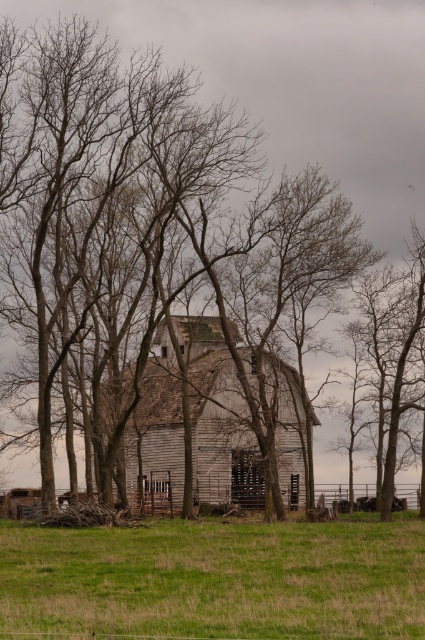
Does green grassy field at lower center appear over weathered wood barn at center?

No.

Is point (360, 524) positioned after point (164, 385)?

That is False.

This screenshot has width=425, height=640. What are the coordinates of `green grassy field at lower center` in the screenshot? It's located at (214, 580).

Does point (153, 113) come closer to viewer compared to point (173, 435)?

Yes.

Who is taller, brown wood tree at center or weathered wood barn at center?

brown wood tree at center is taller.

In order to click on brown wood tree at center in this screenshot , I will do `click(90, 170)`.

Can you confirm if green grassy field at lower center is bigger than brown wood tree at center?

Actually, green grassy field at lower center might be smaller than brown wood tree at center.

Between green grassy field at lower center and brown wood tree at center, which one is positioned lower?

green grassy field at lower center is below.

Is point (234, 580) in front of point (22, 45)?

Yes.

At what (x,y) coordinates should I click in order to perform the action: click on green grassy field at lower center. Please return your answer as a coordinate pair (x, y). Image resolution: width=425 pixels, height=640 pixels. Looking at the image, I should click on (214, 580).